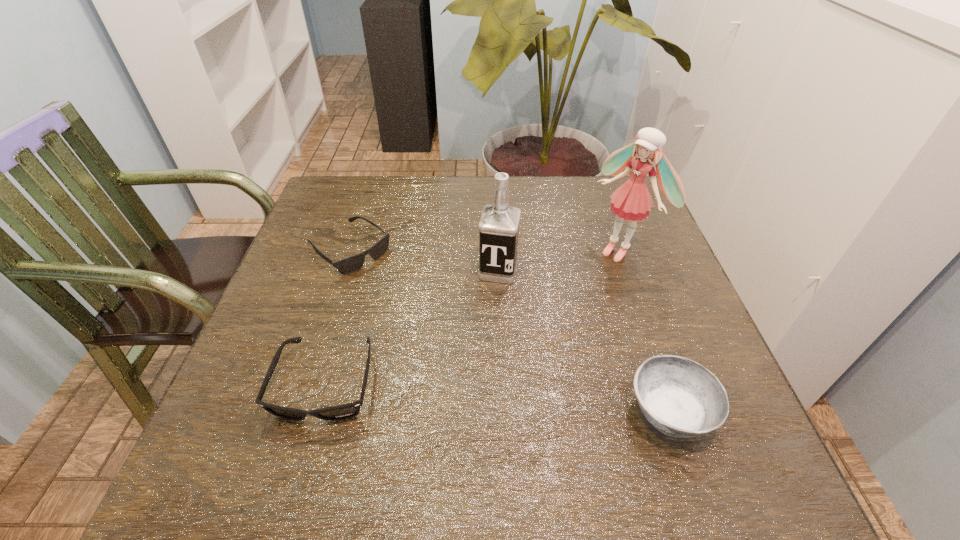
In order to click on blank area located on the front-facing side of the doll in this screenshot , I will do `click(574, 288)`.

The image size is (960, 540). In order to click on vacant space located on the front-facing side of the doll in this screenshot , I will do `click(515, 337)`.

Image resolution: width=960 pixels, height=540 pixels. I want to click on vacant space situated on the front label of the fourth shortest object, so click(463, 421).

I want to click on free space located on the front label of the fourth shortest object, so click(487, 320).

The image size is (960, 540). I want to click on blank space located 0.290m on the front label of the fourth shortest object, so click(x=468, y=395).

This screenshot has width=960, height=540. Find the location of `vacant area situated on the front-facing side of the shortest object`. vacant area situated on the front-facing side of the shortest object is located at coordinates (429, 315).

Locate an element on the screen. Image resolution: width=960 pixels, height=540 pixels. vacant area situated on the front-facing side of the shortest object is located at coordinates (468, 347).

I want to click on vacant space located on the front-facing side of the shortest object, so click(458, 339).

Where is `object that is positioned at the far edge`? This screenshot has width=960, height=540. object that is positioned at the far edge is located at coordinates (352, 263).

Find the location of a particular element. sunglasses present at the near edge is located at coordinates (340, 412).